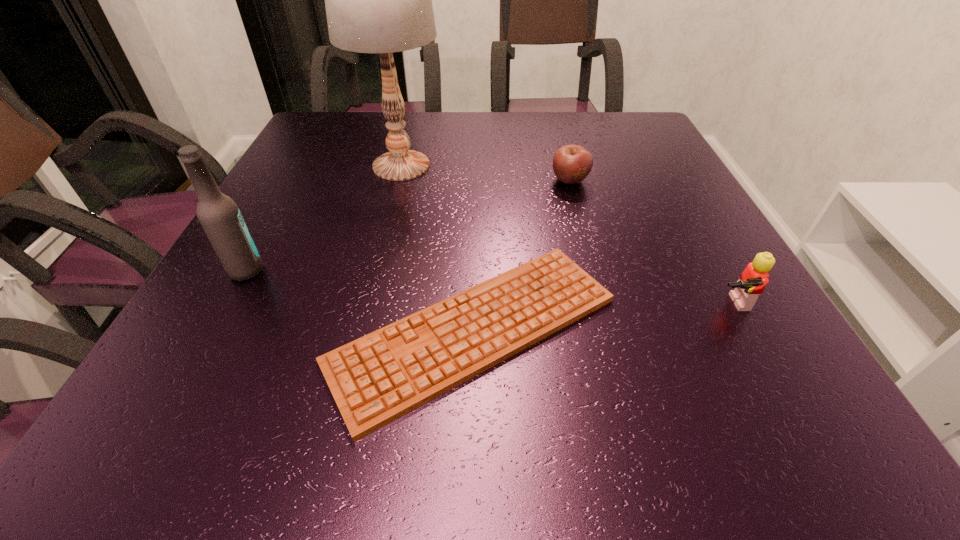
The image size is (960, 540). What are the coordinates of `vacant space at the far right corner of the desktop` in the screenshot? It's located at (594, 119).

Where is `vacant point located between the Lego and the tallest object`? vacant point located between the Lego and the tallest object is located at coordinates (565, 234).

This screenshot has width=960, height=540. In order to click on vacant point located between the lamp and the apple in this screenshot , I will do `click(486, 173)`.

This screenshot has width=960, height=540. In order to click on vacant area that lies between the leftmost object and the apple in this screenshot , I will do `click(408, 225)`.

The height and width of the screenshot is (540, 960). I want to click on vacant space that's between the shortest object and the fourth tallest object, so click(522, 255).

This screenshot has height=540, width=960. What are the coordinates of `free area in between the apple and the second tallest object` in the screenshot? It's located at (408, 225).

What are the coordinates of `free space between the shortest object and the leftmost object` in the screenshot? It's located at pos(360,300).

Identify the location of vacant region between the lamp and the rightmost object. The image size is (960, 540). (565, 234).

Locate an element on the screen. This screenshot has height=540, width=960. empty space between the beer bottle and the tallest object is located at coordinates (324, 218).

Identify the location of free spot between the second shortest object and the leftmost object. (408, 225).